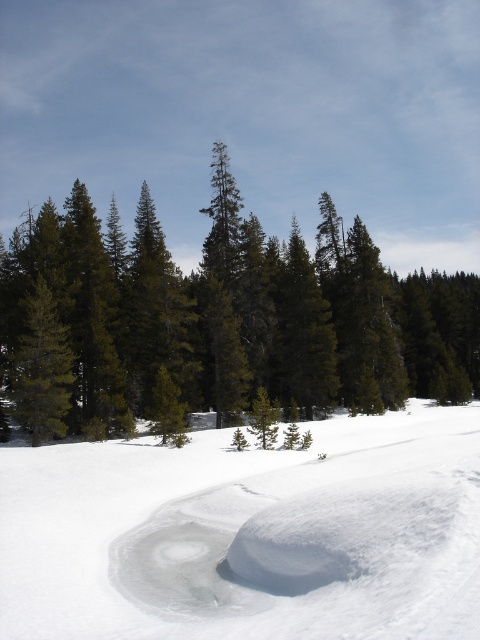
Question: Which point is closer to the camera?

Choices:
 (A) (71, 352)
 (B) (36, 420)

Answer: (B)

Question: Which is farther from the white snow at center?

Choices:
 (A) green matte tree at center
 (B) green matte tree at left

Answer: (A)

Question: Is green matte tree at center in front of green matte tree at left?

Choices:
 (A) no
 (B) yes

Answer: (B)

Question: Can you confirm if white snow at center is smaller than green matte tree at center?

Choices:
 (A) yes
 (B) no

Answer: (A)

Question: Estimate the real-world distances between objects in this image. Which object is farther from the green matte tree at center?

Choices:
 (A) white snow at center
 (B) green matte tree at left

Answer: (A)

Question: Is white snow at center closer to camera compared to green matte tree at left?

Choices:
 (A) yes
 (B) no

Answer: (A)